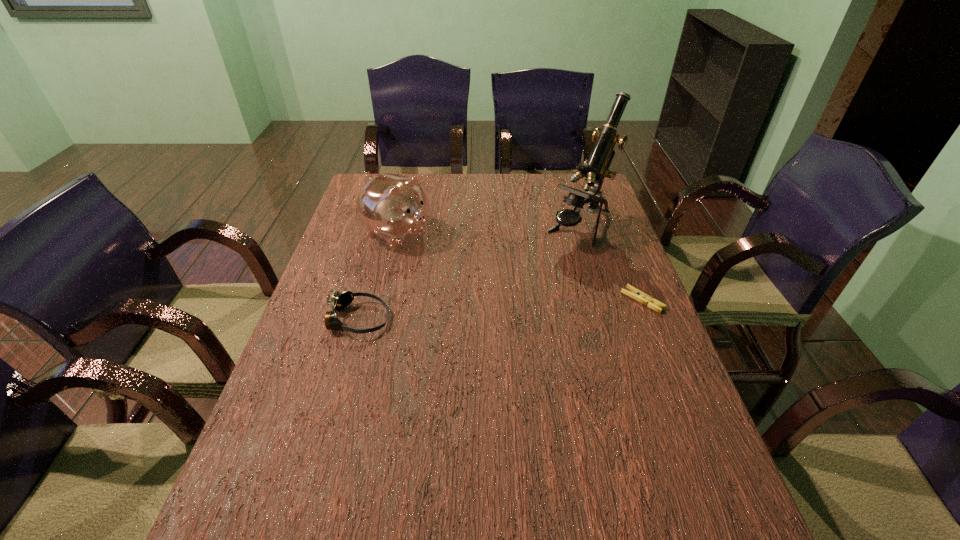
Where is `free space on the desktop that is between the goggles and the shortest object and is positioned on the front facing side of the third shortest object`? The image size is (960, 540). free space on the desktop that is between the goggles and the shortest object and is positioned on the front facing side of the third shortest object is located at coordinates (544, 307).

Where is `vacant space on the desktop that is between the goggles and the clothespin and is positioned through the eyepiece of the microscope`? This screenshot has width=960, height=540. vacant space on the desktop that is between the goggles and the clothespin and is positioned through the eyepiece of the microscope is located at coordinates (488, 311).